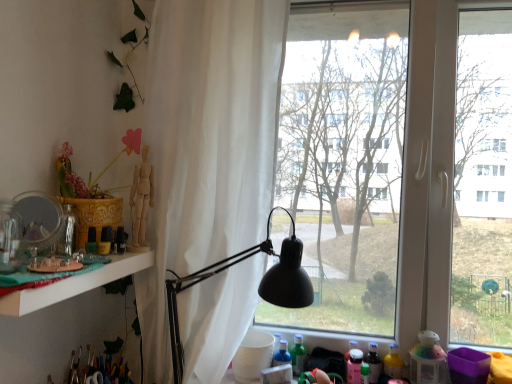
Question: Looking at their shapes, would you say green matte bottle at lower center, which is the second bottle in right-to-left order, is wider or thinner than wooden mannequin at left?

Choices:
 (A) wide
 (B) thin

Answer: (A)

Question: Is green matte bottle at lower center, which is the second bottle in right-to-left order, in front of or behind wooden mannequin at left in the image?

Choices:
 (A) front
 (B) behind

Answer: (B)

Question: Which is farther from the white sheer curtain at center?

Choices:
 (A) translucent plastic toy at lower right
 (B) black matte lamp at center
 (C) transparent glass window at center
 (D) wooden mannequin at left
 (E) white glossy shelf at left

Answer: (A)

Question: Estimate the real-world distances between objects in this image. Which object is closer to the wooden mannequin at left?

Choices:
 (A) white glossy shelf at left
 (B) transparent glass window at center
 (C) translucent plastic bottle at lower right, the first bottle from the right
 (D) white sheer curtain at center
 (E) matte silver mirror at left

Answer: (A)